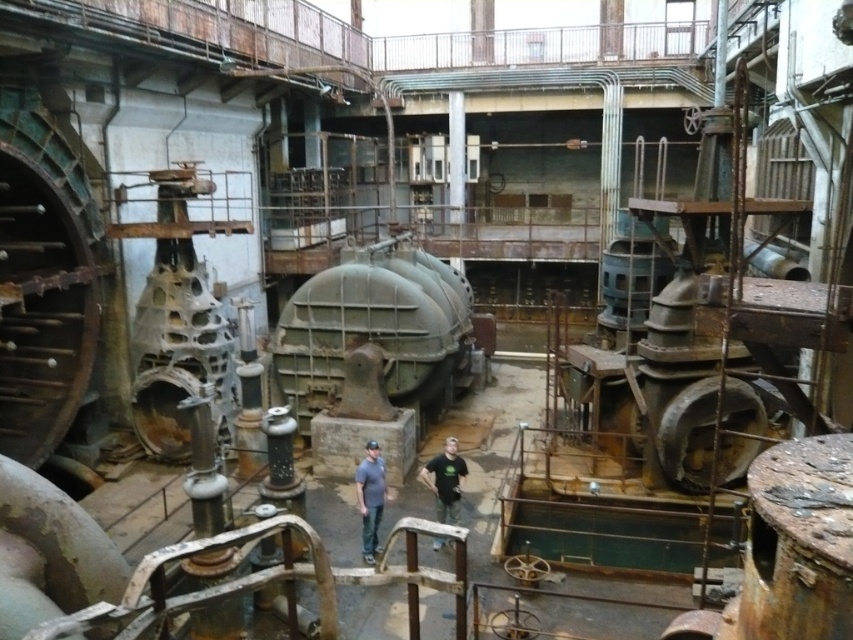
You are standing in the industrial facility and notice a point at coordinates (370, 497). What object is located at that point?

The object at point (370, 497) is the matte gray shirt at center.

You are an inspector in this industrial facility and need to check the machinery. You notice two workers wearing the matte gray shirt at center and the black cotton shirt at center. Which worker is standing closer to the ground?

The matte gray shirt at center is located below the black cotton shirt at center, so the worker wearing the matte gray shirt at center is standing closer to the ground.